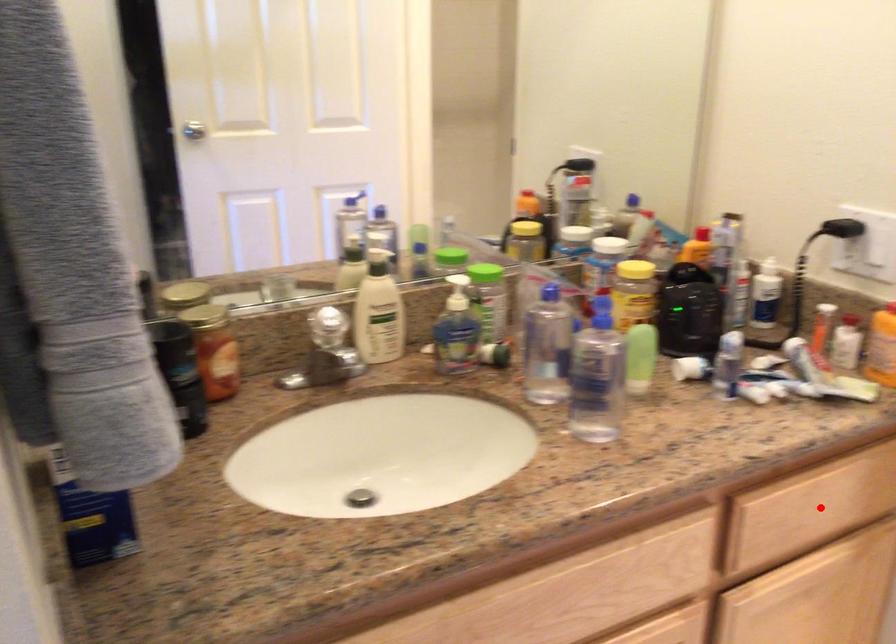
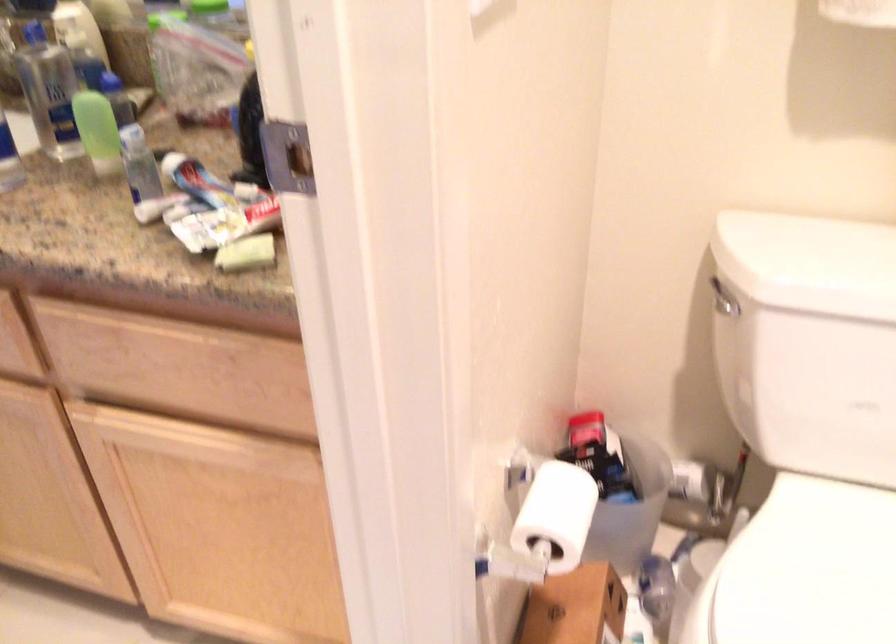
The point at the highlighted location is marked in the first image. Where is the corresponding point in the second image?

(177, 368)